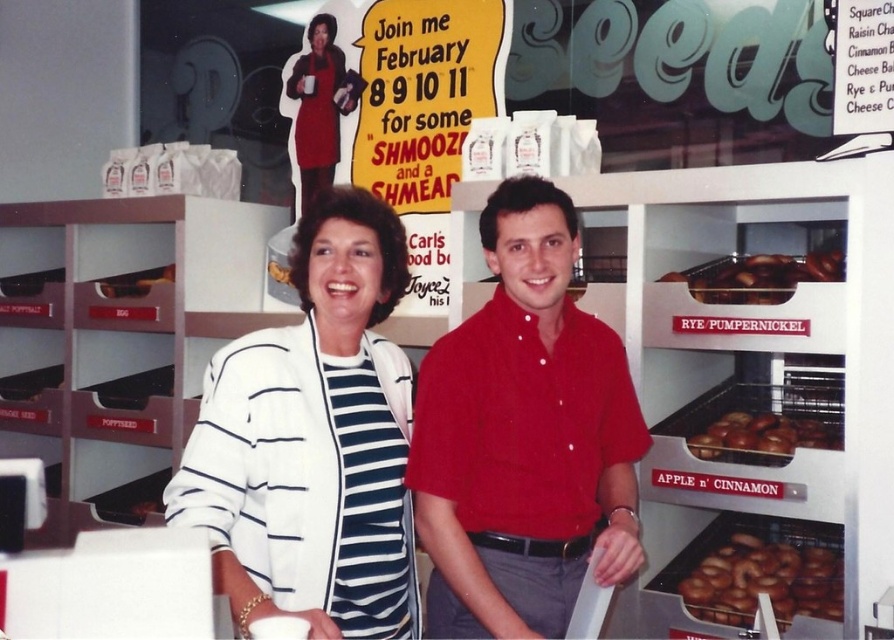
Question: Does white striped blazer at center appear over brown matte bagels at center right?

Choices:
 (A) yes
 (B) no

Answer: (B)

Question: Is brown matte bagels at center right thinner than brown matte donuts at center right?

Choices:
 (A) no
 (B) yes

Answer: (A)

Question: Considering the real-world distances, which object is farthest from the red cotton shirt at center?

Choices:
 (A) golden brown bagel at right
 (B) brown matte donuts at center right
 (C) brown matte bagels at center right
 (D) white striped blazer at center

Answer: (A)

Question: Which object is positioned farthest from the red cotton shirt at center?

Choices:
 (A) brown matte bagels at center right
 (B) golden brown bagel at right

Answer: (B)

Question: Does golden brown bagel at right have a greater width compared to brown matte donuts at center right?

Choices:
 (A) yes
 (B) no

Answer: (A)

Question: Which object is the farthest from the golden brown bagel at right?

Choices:
 (A) brown matte donuts at center right
 (B) white striped blazer at center

Answer: (B)